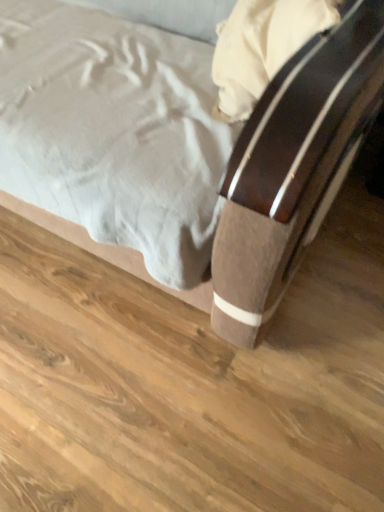
Question: Does matte brown bed at center lie behind brown wood bed frame at lower center?

Choices:
 (A) yes
 (B) no

Answer: (B)

Question: Considering the relative positions of matte brown bed at center and brown wood bed frame at lower center in the image provided, is matte brown bed at center to the right of brown wood bed frame at lower center from the viewer's perspective?

Choices:
 (A) yes
 (B) no

Answer: (B)

Question: Considering the relative positions of matte brown bed at center and brown wood bed frame at lower center in the image provided, is matte brown bed at center to the left of brown wood bed frame at lower center from the viewer's perspective?

Choices:
 (A) no
 (B) yes

Answer: (B)

Question: Does matte brown bed at center have a greater width compared to brown wood bed frame at lower center?

Choices:
 (A) yes
 (B) no

Answer: (B)

Question: Considering the relative sizes of matte brown bed at center and brown wood bed frame at lower center in the image provided, is matte brown bed at center smaller than brown wood bed frame at lower center?

Choices:
 (A) no
 (B) yes

Answer: (A)

Question: Can you confirm if matte brown bed at center is shorter than brown wood bed frame at lower center?

Choices:
 (A) no
 (B) yes

Answer: (A)

Question: Does brown wood bed frame at lower center have a larger size compared to matte brown bed at center?

Choices:
 (A) no
 (B) yes

Answer: (A)

Question: Considering the relative sizes of brown wood bed frame at lower center and matte brown bed at center in the image provided, is brown wood bed frame at lower center wider than matte brown bed at center?

Choices:
 (A) no
 (B) yes

Answer: (B)

Question: Considering the relative sizes of brown wood bed frame at lower center and matte brown bed at center in the image provided, is brown wood bed frame at lower center shorter than matte brown bed at center?

Choices:
 (A) no
 (B) yes

Answer: (B)

Question: Does brown wood bed frame at lower center appear on the left side of matte brown bed at center?

Choices:
 (A) yes
 (B) no

Answer: (B)

Question: Considering the relative sizes of brown wood bed frame at lower center and matte brown bed at center in the image provided, is brown wood bed frame at lower center taller than matte brown bed at center?

Choices:
 (A) no
 (B) yes

Answer: (A)

Question: Does brown wood bed frame at lower center touch matte brown bed at center?

Choices:
 (A) yes
 (B) no

Answer: (B)

Question: Is brown wood bed frame at lower center wider or thinner than matte brown bed at center?

Choices:
 (A) wide
 (B) thin

Answer: (A)